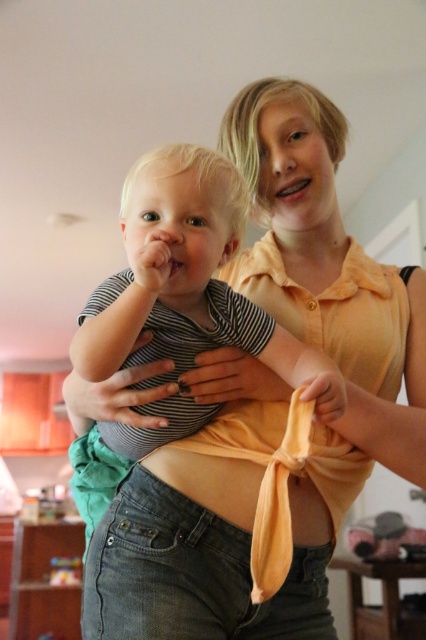
You are designing a costume for a play and need to decide which fabric to use. The striped fabric shirt at center and the orange fabric at center are both available. If you want to use the larger piece of fabric, which one should you choose?

The striped fabric shirt at center is bigger than orange fabric at center, so you should choose the striped fabric shirt at center as the larger piece of fabric.

You are a photographer adjusting your camera settings to focus on the striped fabric shirt at center and the orange fabric at center. Which object should you focus on first to ensure it appears sharp in the photo?

The striped fabric shirt at center is closer to the viewer than the orange fabric at center, so you should focus on the striped fabric shirt at center first to ensure it appears sharp.